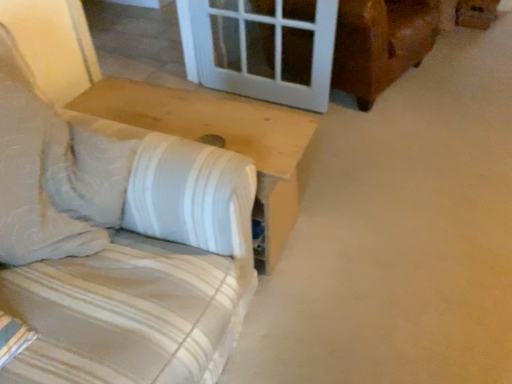
The width and height of the screenshot is (512, 384). I want to click on white striped fabric couch at left, so click(118, 243).

I want to click on brown cardboard box at upper right, so click(x=476, y=13).

At what (x,y) coordinates should I click in order to perform the action: click on white striped fabric couch at left. Please return your answer as a coordinate pair (x, y). This screenshot has height=384, width=512. Looking at the image, I should click on (118, 243).

Between white wood table at lower left and white striped fabric couch at left, which one has smaller size?

With smaller size is white wood table at lower left.

Is white wood table at lower left not close to white striped fabric couch at left?

They are positioned close to each other.

Choose the correct answer: Is white wood table at lower left inside white striped fabric couch at left or outside it?

white wood table at lower left is located beyond the bounds of white striped fabric couch at left.

Can you confirm if white wood table at lower left is shorter than white striped fabric couch at left?

Incorrect, the height of white wood table at lower left does not fall short of that of white striped fabric couch at left.

In the image, there is a white wood table at lower left. Where is `cardboard box below it (from a real-world perspective)`? The image size is (512, 384). cardboard box below it (from a real-world perspective) is located at coordinates (476, 13).

Would you say white wood table at lower left contains brown cardboard box at upper right?

No, brown cardboard box at upper right is not surrounded by white wood table at lower left.

From a real-world perspective, is white wood table at lower left below brown cardboard box at upper right?

Incorrect, from a real-world perspective, white wood table at lower left is higher than brown cardboard box at upper right.

Is white wood table at lower left positioned far away from brown cardboard box at upper right?

Yes.

Considering the sizes of white striped fabric couch at left and white wood table at lower left in the image, is white striped fabric couch at left taller or shorter than white wood table at lower left?

Considering their sizes, white striped fabric couch at left has less height than white wood table at lower left.

Is white striped fabric couch at left touching white wood table at lower left?

They are not placed beside each other.

Would you say white striped fabric couch at left is to the left or to the right of white wood table at lower left in the picture?

Based on their positions, white striped fabric couch at left is located to the left of white wood table at lower left.

Which of these two, brown cardboard box at upper right or white wood table at lower left, stands shorter?

brown cardboard box at upper right is shorter.

Is brown cardboard box at upper right bigger or smaller than white wood table at lower left?

Considering their sizes, brown cardboard box at upper right takes up less space than white wood table at lower left.

Is brown cardboard box at upper right wider than white wood table at lower left?

In fact, brown cardboard box at upper right might be narrower than white wood table at lower left.

Where is `cardboard box behind the white wood table at lower left`? The height and width of the screenshot is (384, 512). cardboard box behind the white wood table at lower left is located at coordinates (476, 13).

From the image's perspective, which one is positioned lower, brown cardboard box at upper right or white striped fabric couch at left?

white striped fabric couch at left, from the image's perspective.

Is brown cardboard box at upper right at the left side of white striped fabric couch at left?

Incorrect, brown cardboard box at upper right is not on the left side of white striped fabric couch at left.

Looking at this image, measure the distance from brown cardboard box at upper right to white striped fabric couch at left.

brown cardboard box at upper right is 3.26 meters away from white striped fabric couch at left.

From a real-world perspective, is brown cardboard box at upper right physically below white striped fabric couch at left?

Yes.

The height and width of the screenshot is (384, 512). What are the coordinates of `cardboard box behind the white striped fabric couch at left` in the screenshot? It's located at (476, 13).

Is white striped fabric couch at left bigger or smaller than brown cardboard box at upper right?

In the image, white striped fabric couch at left appears to be larger than brown cardboard box at upper right.

Would you say white striped fabric couch at left is inside or outside brown cardboard box at upper right?

The correct answer is: outside.

From a real-world perspective, which object stands above the other?

In real-world perspective, white striped fabric couch at left is above.

At what (x,y) coordinates should I click in order to perform the action: click on table on the right of white striped fabric couch at left. Please return your answer as a coordinate pair (x, y). The height and width of the screenshot is (384, 512). Looking at the image, I should click on (221, 141).

Image resolution: width=512 pixels, height=384 pixels. I want to click on table on the left of brown cardboard box at upper right, so click(221, 141).

Looking at the image, which one is located further to white wood table at lower left, white striped fabric couch at left or brown cardboard box at upper right?

brown cardboard box at upper right.

Estimate the real-world distances between objects in this image. Which object is further from brown cardboard box at upper right, white wood table at lower left or white striped fabric couch at left?

white striped fabric couch at left lies further to brown cardboard box at upper right than the other object.

Looking at this image, which object lies further to the anchor point white striped fabric couch at left, brown cardboard box at upper right or white wood table at lower left?

brown cardboard box at upper right is further to white striped fabric couch at left.

Based on their spatial positions, is white wood table at lower left or brown cardboard box at upper right closer to white striped fabric couch at left?

Based on the image, white wood table at lower left appears to be nearer to white striped fabric couch at left.

From the image, which object appears to be farther from white wood table at lower left, brown cardboard box at upper right or white striped fabric couch at left?

brown cardboard box at upper right is positioned further to the anchor white wood table at lower left.

Looking at the image, which one is located further to brown cardboard box at upper right, white striped fabric couch at left or white wood table at lower left?

white striped fabric couch at left lies further to brown cardboard box at upper right than the other object.

Locate an element on the screen. The width and height of the screenshot is (512, 384). table located between white striped fabric couch at left and brown cardboard box at upper right in the depth direction is located at coordinates (221, 141).